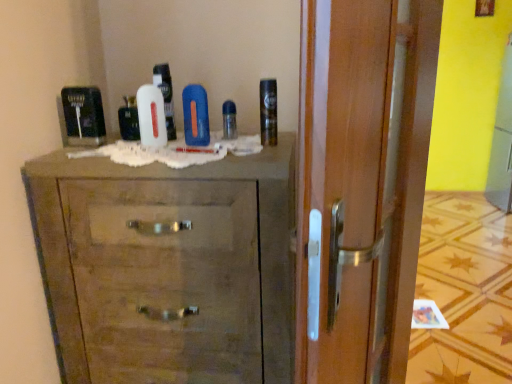
Locate an element on the screen. blue glossy mouthwash at center, which is counted as the 1th mouthwash, starting from the right is located at coordinates (229, 120).

Measure the distance between point (166,73) and camera.

4.09 feet.

Identify the location of wooden chest of drawers at center. (167, 267).

At what (x,y) coordinates should I click in order to perform the action: click on blue matte bottle at center. Please return your answer as a coordinate pair (x, y). This screenshot has height=384, width=512. Looking at the image, I should click on (195, 115).

Where is `white glossy mouthwash at center, placed as the 1th mouthwash when sorted from left to right`? This screenshot has height=384, width=512. white glossy mouthwash at center, placed as the 1th mouthwash when sorted from left to right is located at coordinates (129, 119).

The width and height of the screenshot is (512, 384). Describe the element at coordinates (129, 119) in the screenshot. I see `white glossy mouthwash at center, which is the 2th mouthwash from right to left` at that location.

Image resolution: width=512 pixels, height=384 pixels. What do you see at coordinates (268, 111) in the screenshot?
I see `shiny metallic can at upper right, positioned as the 3th shaving cream in left-to-right order` at bounding box center [268, 111].

The image size is (512, 384). I want to click on blue glossy mouthwash at center, the second mouthwash when ordered from left to right, so (x=229, y=120).

From a real-world perspective, is shiny metallic can at upper right, positioned as the 3th shaving cream in left-to-right order, physically located above or below blue matte bottle at center?

From a real-world perspective, shiny metallic can at upper right, positioned as the 3th shaving cream in left-to-right order, is physically above blue matte bottle at center.

Is shiny metallic can at upper right, marked as the first shaving cream in a right-to-left arrangement, behind blue matte bottle at center?

No.

Would you consider shiny metallic can at upper right, positioned as the 3th shaving cream in left-to-right order, to be distant from blue matte bottle at center?

shiny metallic can at upper right, positioned as the 3th shaving cream in left-to-right order, is actually quite close to blue matte bottle at center.

Does shiny metallic can at upper right, marked as the first shaving cream in a right-to-left arrangement, have a greater height compared to blue matte bottle at center?

Correct, shiny metallic can at upper right, marked as the first shaving cream in a right-to-left arrangement, is much taller as blue matte bottle at center.

From the image's perspective, which one is positioned higher, blue matte bottle at center or yellow matte screen door at upper right?

From the image's view, yellow matte screen door at upper right is above.

Looking at this image, which is more to the left, blue matte bottle at center or yellow matte screen door at upper right?

Positioned to the left is blue matte bottle at center.

The width and height of the screenshot is (512, 384). I want to click on screen door behind the blue matte bottle at center, so click(x=502, y=141).

Considering the relative sizes of blue matte bottle at center and yellow matte screen door at upper right in the image provided, is blue matte bottle at center wider than yellow matte screen door at upper right?

No, blue matte bottle at center is not wider than yellow matte screen door at upper right.

Which object is closer to the camera, white matte shaving cream at center, the second shaving cream in the left-to-right sequence, or blue glossy mouthwash at center, which is counted as the 1th mouthwash, starting from the right?

white matte shaving cream at center, the second shaving cream in the left-to-right sequence, is closer to the camera.

Is white matte shaving cream at center, the 2th shaving cream positioned from the right, at the right side of blue glossy mouthwash at center, which is counted as the 1th mouthwash, starting from the right?

No.

Which point is more forward, (x=158, y=76) or (x=236, y=137)?

Point (x=158, y=76)

Is white matte shaving cream at center, the second shaving cream in the left-to-right sequence, located outside blue glossy mouthwash at center, the second mouthwash when ordered from left to right?

white matte shaving cream at center, the second shaving cream in the left-to-right sequence, lies outside blue glossy mouthwash at center, the second mouthwash when ordered from left to right,'s area.

Which is more to the right, white matte shaving cream at center, which is the first shaving cream from left to right, or yellow matte screen door at upper right?

yellow matte screen door at upper right.

From a real-world perspective, is white matte shaving cream at center, which is the first shaving cream from left to right, positioned above or below yellow matte screen door at upper right?

white matte shaving cream at center, which is the first shaving cream from left to right, is above yellow matte screen door at upper right.

Is white matte shaving cream at center, which is the first shaving cream from left to right, completely or partially outside of yellow matte screen door at upper right?

Yes.

Is white matte shaving cream at center, which is the first shaving cream from left to right, not close to yellow matte screen door at upper right?

Yes, white matte shaving cream at center, which is the first shaving cream from left to right, is far from yellow matte screen door at upper right.

Is white matte shaving cream at center, the 2th shaving cream positioned from the right, situated inside yellow matte screen door at upper right or outside?

white matte shaving cream at center, the 2th shaving cream positioned from the right, is outside yellow matte screen door at upper right.

Is yellow matte screen door at upper right at the back of white matte shaving cream at center, the second shaving cream in the left-to-right sequence?

white matte shaving cream at center, the second shaving cream in the left-to-right sequence, does not have its back to yellow matte screen door at upper right.

Where is `screen door below the white matte shaving cream at center, the 2th shaving cream positioned from the right (from a real-world perspective)`? screen door below the white matte shaving cream at center, the 2th shaving cream positioned from the right (from a real-world perspective) is located at coordinates (502, 141).

From the image's perspective, which object appears higher, white matte shaving cream at center, the 2th shaving cream positioned from the right, or yellow matte screen door at upper right?

yellow matte screen door at upper right.

Which of these two, shiny metallic can at upper right, positioned as the 3th shaving cream in left-to-right order, or blue glossy mouthwash at center, which is counted as the 1th mouthwash, starting from the right, is smaller?

blue glossy mouthwash at center, which is counted as the 1th mouthwash, starting from the right, is smaller.

Can you confirm if shiny metallic can at upper right, positioned as the 3th shaving cream in left-to-right order, is shorter than blue glossy mouthwash at center, which is counted as the 1th mouthwash, starting from the right?

No.

Based on the photo, is shiny metallic can at upper right, positioned as the 3th shaving cream in left-to-right order, at the right side of blue glossy mouthwash at center, which is counted as the 1th mouthwash, starting from the right?

Correct, you'll find shiny metallic can at upper right, positioned as the 3th shaving cream in left-to-right order, to the right of blue glossy mouthwash at center, which is counted as the 1th mouthwash, starting from the right.

Is shiny metallic can at upper right, positioned as the 3th shaving cream in left-to-right order, looking in the opposite direction of blue glossy mouthwash at center, which is counted as the 1th mouthwash, starting from the right?

That's not correct — shiny metallic can at upper right, positioned as the 3th shaving cream in left-to-right order, is not looking away from blue glossy mouthwash at center, which is counted as the 1th mouthwash, starting from the right.

What's the angular difference between blue matte bottle at center and white matte shaving cream at center, the 2th shaving cream positioned from the right,'s facing directions?

The facing directions of blue matte bottle at center and white matte shaving cream at center, the 2th shaving cream positioned from the right, are 0.0102 degrees apart.

Find the location of a particular element. toiletry that appears on the right of white matte shaving cream at center, the 2th shaving cream positioned from the right is located at coordinates (195, 115).

Does point (204, 113) come behind point (170, 76)?

No, (204, 113) is closer to viewer.

Considering the sizes of objects blue matte bottle at center and white matte shaving cream at center, the second shaving cream in the left-to-right sequence, in the image provided, who is wider, blue matte bottle at center or white matte shaving cream at center, the second shaving cream in the left-to-right sequence,?

With larger width is blue matte bottle at center.

The image size is (512, 384). What are the coordinates of `shaving cream on the right side of blue matte bottle at center` in the screenshot? It's located at (268, 111).

Identify the location of toiletry that is below the yellow matte screen door at upper right (from the image's perspective). The height and width of the screenshot is (384, 512). (195, 115).

Looking at this image, looking at the image, which one is located further to white matte shaving cream at center, the 2th shaving cream positioned from the right, wooden chest of drawers at center or yellow matte screen door at upper right?

The object further to white matte shaving cream at center, the 2th shaving cream positioned from the right, is yellow matte screen door at upper right.

Considering their positions, is white matte shaving cream at center, the second shaving cream in the left-to-right sequence, positioned closer to wooden chest of drawers at center than blue glossy mouthwash at center, the second mouthwash when ordered from left to right?

Among the two, white matte shaving cream at center, the second shaving cream in the left-to-right sequence, is located nearer to wooden chest of drawers at center.

Based on the photo, looking at the image, which one is located further to shiny metallic can at upper right, marked as the first shaving cream in a right-to-left arrangement, blue glossy mouthwash at center, the second mouthwash when ordered from left to right, or white matte shaving cream at center, which is the first shaving cream from left to right?

white matte shaving cream at center, which is the first shaving cream from left to right.

When comparing their distances from blue glossy mouthwash at center, which is counted as the 1th mouthwash, starting from the right, does yellow matte screen door at upper right or white glossy mouthwash at center, which is the 2th mouthwash from right to left, seem closer?

white glossy mouthwash at center, which is the 2th mouthwash from right to left, is positioned closer to the anchor blue glossy mouthwash at center, which is counted as the 1th mouthwash, starting from the right.

Considering their positions, is blue glossy mouthwash at center, the second mouthwash when ordered from left to right, positioned closer to white matte shaving cream at center, acting as the third shaving cream starting from the right, than wooden chest of drawers at center?

Among the two, blue glossy mouthwash at center, the second mouthwash when ordered from left to right, is located nearer to white matte shaving cream at center, acting as the third shaving cream starting from the right.

Looking at the image, which one is located closer to wooden chest of drawers at center, white glossy mouthwash at center, placed as the 1th mouthwash when sorted from left to right, or yellow matte screen door at upper right?

white glossy mouthwash at center, placed as the 1th mouthwash when sorted from left to right, lies closer to wooden chest of drawers at center than the other object.

Based on their spatial positions, is blue glossy mouthwash at center, the second mouthwash when ordered from left to right, or white glossy mouthwash at center, placed as the 1th mouthwash when sorted from left to right, further from yellow matte screen door at upper right?

white glossy mouthwash at center, placed as the 1th mouthwash when sorted from left to right, is positioned further to the anchor yellow matte screen door at upper right.

Based on their spatial positions, is blue matte bottle at center or blue glossy mouthwash at center, the second mouthwash when ordered from left to right, closer to white matte shaving cream at center, which is the first shaving cream from left to right?

blue matte bottle at center is positioned closer to the anchor white matte shaving cream at center, which is the first shaving cream from left to right.

I want to click on shaving cream located between blue matte bottle at center and yellow matte screen door at upper right in the left-right direction, so click(268, 111).

At what (x,y) coordinates should I click in order to perform the action: click on chest of drawers between white glossy mouthwash at center, which is the 2th mouthwash from right to left, and yellow matte screen door at upper right from left to right. Please return your answer as a coordinate pair (x, y). Looking at the image, I should click on (167, 267).

This screenshot has height=384, width=512. Find the location of `shaving cream situated between white matte shaving cream at center, acting as the third shaving cream starting from the right, and blue glossy mouthwash at center, the second mouthwash when ordered from left to right, from left to right`. shaving cream situated between white matte shaving cream at center, acting as the third shaving cream starting from the right, and blue glossy mouthwash at center, the second mouthwash when ordered from left to right, from left to right is located at coordinates (166, 96).

Locate an element on the screen. Image resolution: width=512 pixels, height=384 pixels. toiletry between white glossy mouthwash at center, which is the 2th mouthwash from right to left, and yellow matte screen door at upper right, in the horizontal direction is located at coordinates (195, 115).